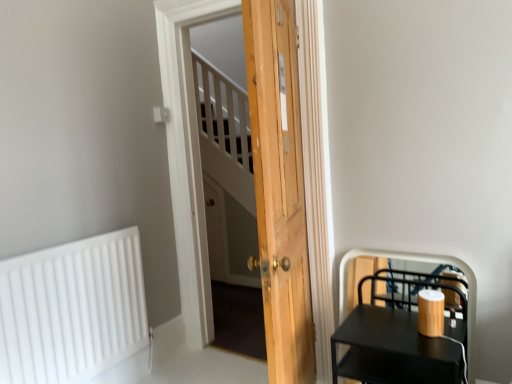
Question: From a real-world perspective, is natural wood door at center positioned above or below black matte side table at lower right?

Choices:
 (A) below
 (B) above

Answer: (B)

Question: From their relative heights in the image, would you say natural wood door at center is taller or shorter than black matte side table at lower right?

Choices:
 (A) tall
 (B) short

Answer: (A)

Question: Which of these objects is positioned closest to the natural wood door at center?

Choices:
 (A) white matte radiator at lower left
 (B) black matte side table at lower right

Answer: (B)

Question: Considering the real-world distances, which object is farthest from the natural wood door at center?

Choices:
 (A) white matte radiator at lower left
 (B) black matte side table at lower right

Answer: (A)